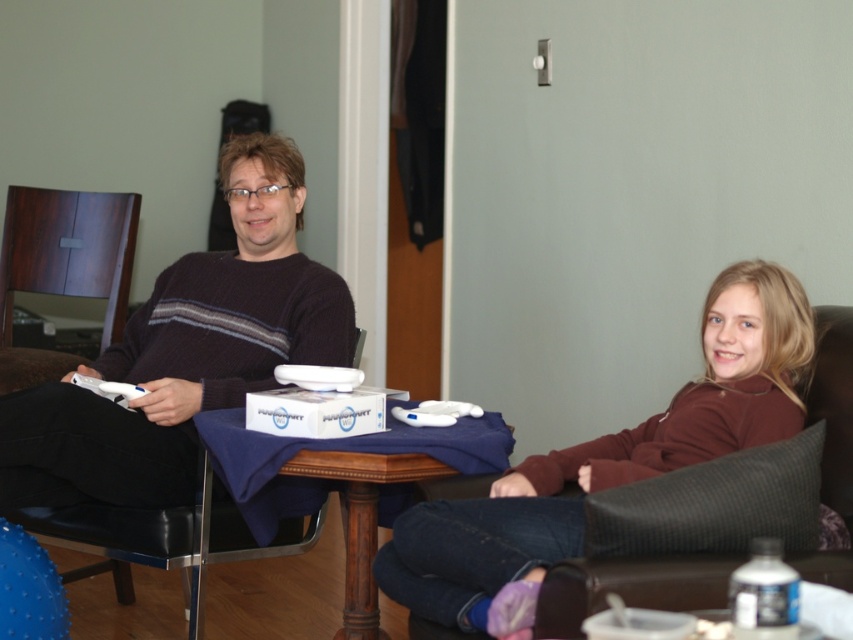
What do you see at coordinates (184, 353) in the screenshot? I see `dark brown sweater at center` at bounding box center [184, 353].

Which is more to the right, dark brown sweater at center or wooden table at center?

wooden table at center

Find the location of a particular element. dark brown sweater at center is located at coordinates (184, 353).

Is brown fleece sweater at center behind wooden table at center?

No.

What are the coordinates of `brown fleece sweater at center` in the screenshot? It's located at (606, 464).

Looking at this image, who is positioned more to the right, dark wood chair at left or wooden table at center?

Positioned to the right is wooden table at center.

Locate an element on the screen. This screenshot has width=853, height=640. dark wood chair at left is located at coordinates (62, 268).